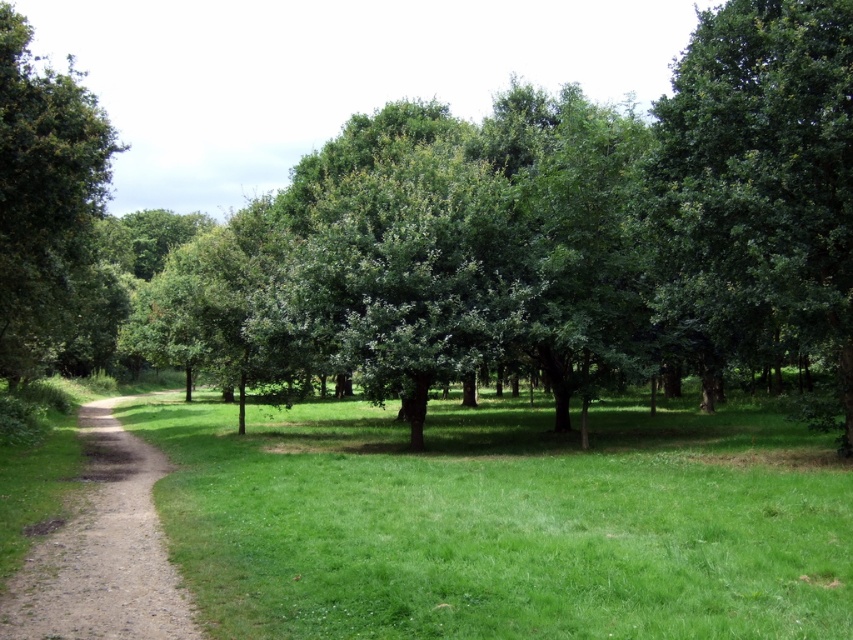
Who is lower down, green leafy tree at left or dirt/gravel path at left?

dirt/gravel path at left is below.

Image resolution: width=853 pixels, height=640 pixels. What do you see at coordinates (49, 209) in the screenshot?
I see `green leafy tree at left` at bounding box center [49, 209].

I want to click on green leafy tree at left, so click(x=49, y=209).

Between green leafy tree at center and dirt/gravel path at left, which one appears on the left side from the viewer's perspective?

Positioned to the left is green leafy tree at center.

Does green leafy tree at center have a lesser height compared to dirt/gravel path at left?

No, green leafy tree at center is not shorter than dirt/gravel path at left.

Is point (747, 10) positioned in front of point (155, 557)?

No, it is behind (155, 557).

You are a GUI agent. You are given a task and a screenshot of the screen. Output one action in this format:
    pyautogui.click(x=<x>, y=<y>)
    Task: Click on the green leafy tree at center
    The image size is (853, 640).
    Given the screenshot: What is the action you would take?
    pyautogui.click(x=479, y=234)

Between green leafy tree at center and green leafy tree at left, which one is positioned lower?

green leafy tree at center is lower down.

Does green leafy tree at center appear on the left side of green leafy tree at left?

Incorrect, green leafy tree at center is not on the left side of green leafy tree at left.

Is point (6, 152) more distant than point (4, 294)?

That is False.

At what (x,y) coordinates should I click in order to perform the action: click on green leafy tree at center. Please return your answer as a coordinate pair (x, y). Image resolution: width=853 pixels, height=640 pixels. Looking at the image, I should click on 479,234.